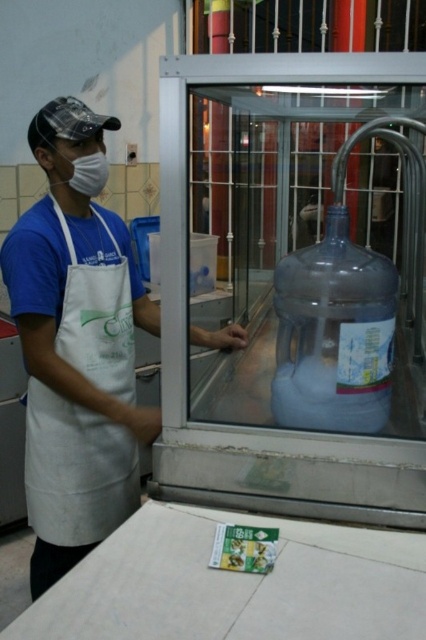
Question: Which point is farther from the camera taking this photo?

Choices:
 (A) (58, 173)
 (B) (92, 164)
 (C) (336, 344)

Answer: (A)

Question: Can you confirm if white apron at left is positioned below white matte mask at left?

Choices:
 (A) no
 (B) yes

Answer: (B)

Question: Which point appears closest to the camera in this image?

Choices:
 (A) (86, 180)
 (B) (40, 506)
 (C) (314, 324)
 (D) (91, 509)

Answer: (C)

Question: Which point appears closest to the camera in this image?

Choices:
 (A) [x=97, y=193]
 (B) [x=370, y=371]

Answer: (B)

Question: Observing the image, what is the correct spatial positioning of white apron at left in reference to white matte mask at left?

Choices:
 (A) above
 (B) below

Answer: (B)

Question: Can you confirm if white cotton apron at left is smaller than transparent plastic bottle at center?

Choices:
 (A) no
 (B) yes

Answer: (A)